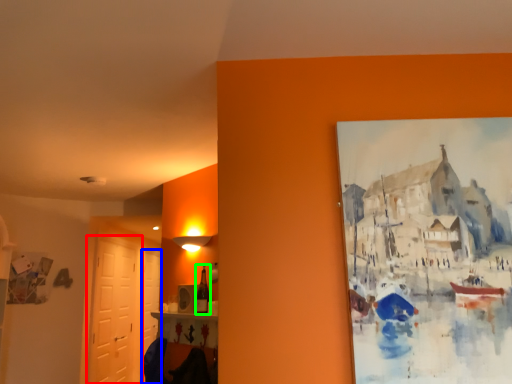
Question: Which is nearer to the door (highlighted by a red box)? door (highlighted by a blue box) or bottle (highlighted by a green box).

Choices:
 (A) door
 (B) bottle

Answer: (A)